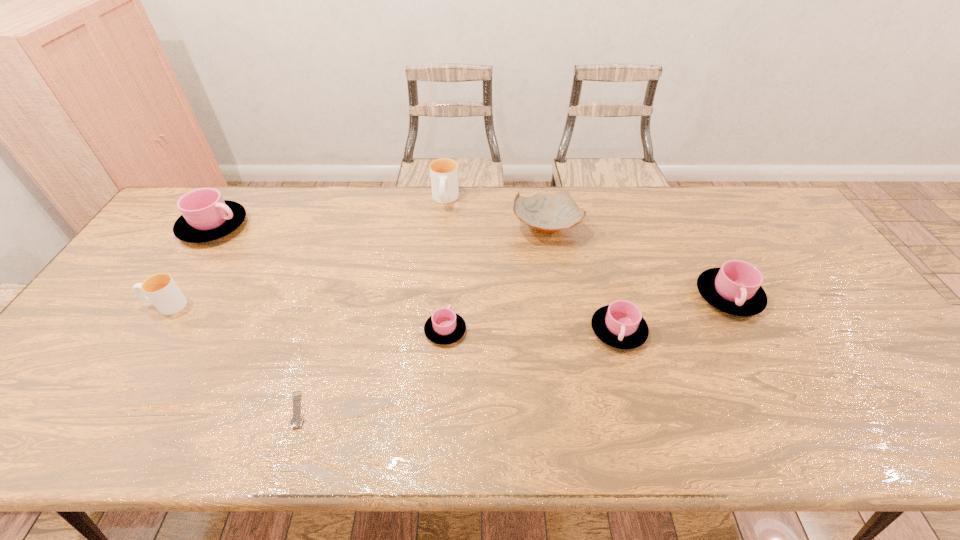
Identify the location of vacant space that satisfies the following two spatial constraints: 1. with the handle on the side of the farther yellow cup; 2. on the left side of the pottery. The width and height of the screenshot is (960, 540). (443, 227).

I want to click on free space that satisfies the following two spatial constraints: 1. on the side with the handle of the smallest pink cup; 2. on the side with the handle of the leftmost pink cup, so click(x=452, y=227).

The width and height of the screenshot is (960, 540). I want to click on vacant space that satisfies the following two spatial constraints: 1. on the side with the handle of the farthest pink cup; 2. with the handle on the side of the left yellow cup, so click(162, 305).

Locate an element on the screen. blank space that satisfies the following two spatial constraints: 1. on the back side of the pottery; 2. on the side with the handle of the farthest pink cup is located at coordinates (545, 227).

At what (x,y) coordinates should I click in order to perform the action: click on blank space that satisfies the following two spatial constraints: 1. with the handle on the side of the pottery; 2. on the right side of the smaller yellow cup. Please return your answer as a coordinate pair (x, y). This screenshot has width=960, height=540. Looking at the image, I should click on (216, 227).